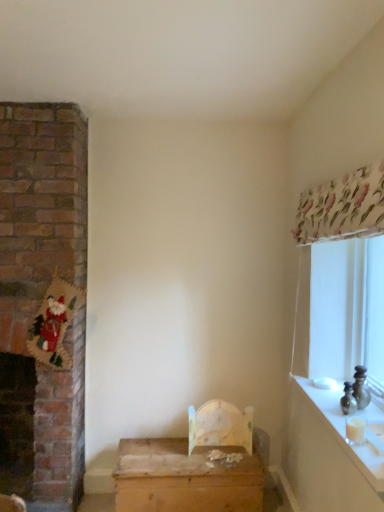
Question: Can you confirm if wooden chest at center is shorter than white glossy counter top at right?

Choices:
 (A) yes
 (B) no

Answer: (B)

Question: From a real-world perspective, is wooden chest at center physically above white glossy counter top at right?

Choices:
 (A) no
 (B) yes

Answer: (A)

Question: Does wooden chest at center have a smaller size compared to white glossy counter top at right?

Choices:
 (A) no
 (B) yes

Answer: (A)

Question: From a real-world perspective, does wooden chest at center sit lower than white glossy counter top at right?

Choices:
 (A) yes
 (B) no

Answer: (A)

Question: Does wooden chest at center lie in front of white glossy counter top at right?

Choices:
 (A) yes
 (B) no

Answer: (B)

Question: Does wooden chest at center lie behind white glossy counter top at right?

Choices:
 (A) yes
 (B) no

Answer: (A)

Question: Is white glossy counter top at right with wooden chest at center?

Choices:
 (A) no
 (B) yes

Answer: (A)

Question: Can you confirm if white glossy counter top at right is taller than wooden chest at center?

Choices:
 (A) no
 (B) yes

Answer: (A)

Question: From a real-world perspective, is white glossy counter top at right located beneath wooden chest at center?

Choices:
 (A) no
 (B) yes

Answer: (A)

Question: Is the depth of white glossy counter top at right greater than that of wooden chest at center?

Choices:
 (A) yes
 (B) no

Answer: (B)

Question: Is white glossy counter top at right thinner than wooden chest at center?

Choices:
 (A) no
 (B) yes

Answer: (B)

Question: Is wooden chest at center completely or partially inside white glossy counter top at right?

Choices:
 (A) no
 (B) yes

Answer: (A)

Question: Considering the positions of white glossy counter top at right and wooden chest at center in the image, is white glossy counter top at right taller or shorter than wooden chest at center?

Choices:
 (A) tall
 (B) short

Answer: (B)